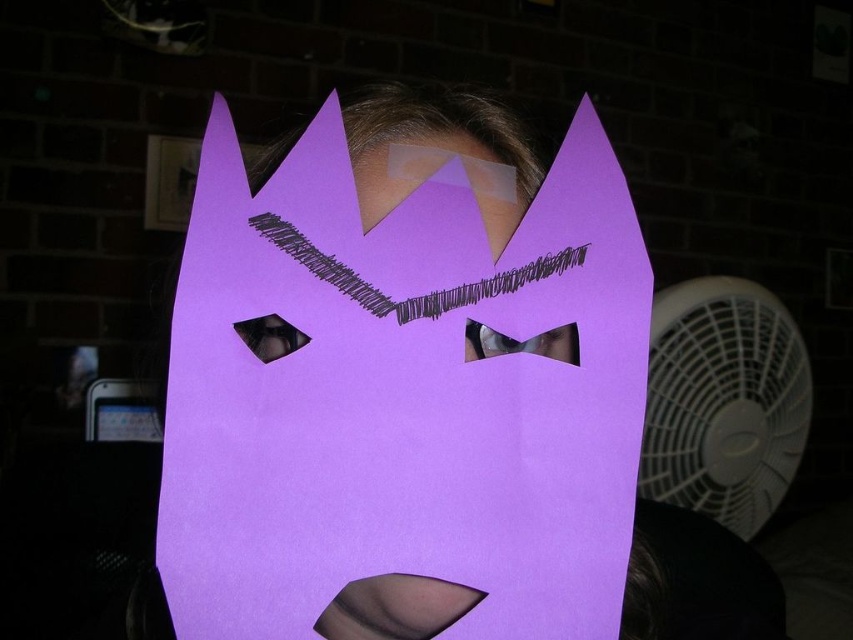
You are an interior designer assessing the placement of the purple paper mask at center and the white plastic fan at right in a room. Based on their sizes, which object would you recommend placing on a higher shelf to ensure proper visibility?

The purple paper mask at center is shorter than the white plastic fan at right, so placing the white plastic fan at right on a higher shelf would allow it to be seen more easily due to its larger size.

You are standing in a room with a dark brick wall. You see a purple paper mask at center and a white plastic fan at right. Which object is closer to the left side of the room?

The purple paper mask at center is closer to the left side of the room than the white plastic fan at right.